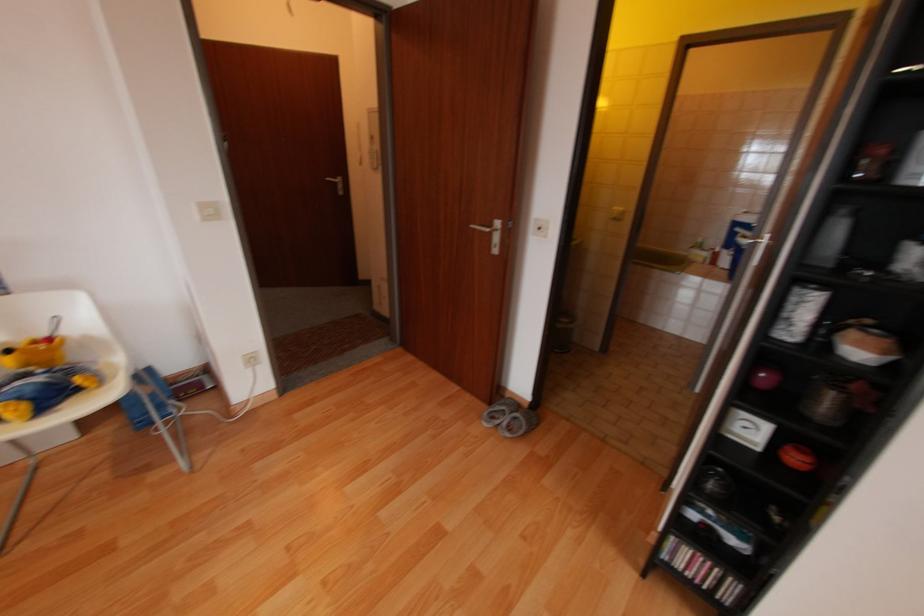
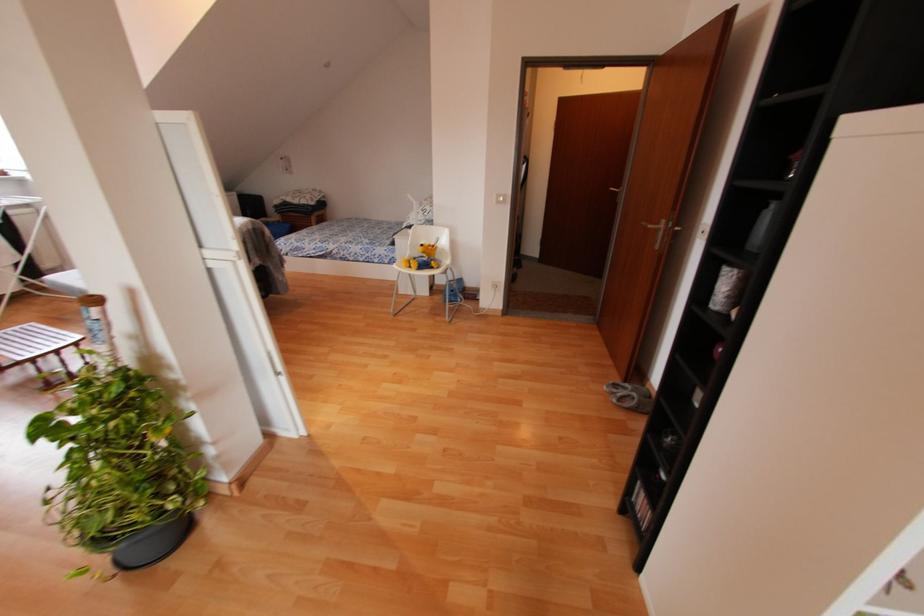
Find the pixel in the second image that matches (507,436) in the first image.

(613, 400)